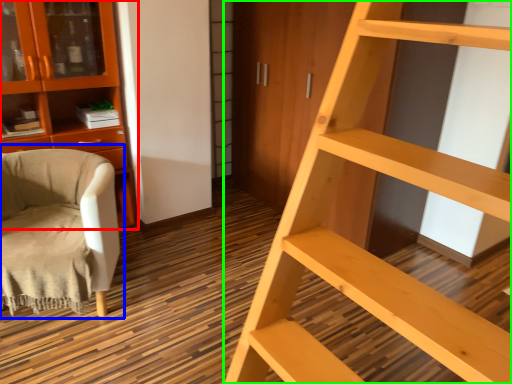
Question: Based on their relative distances, which object is nearer to cabinetry (highlighted by a red box)? Choose from chair (highlighted by a blue box) and ladder (highlighted by a green box).

Choices:
 (A) chair
 (B) ladder

Answer: (A)